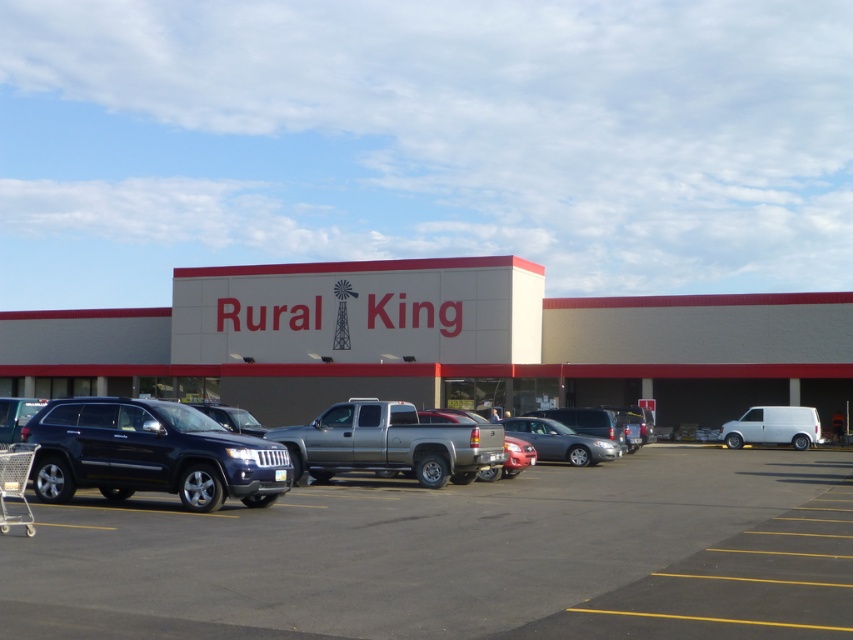
You are a customer who just arrived at the Rural King store. You see the dark gray asphalt at center and the satin silver suv at center. Which one is closer to you as you approach the store entrance?

The dark gray asphalt at center is closer to you because it is in front of the satin silver suv at center, meaning the suv is behind the asphalt area.

From the picture: You are standing in a field 50 meters away from the beige concrete building at center. Can you safely walk towards the building without crossing any obstacles?

The beige concrete building at center is 47.77 meters away from the viewer, so yes, you can safely walk towards the building without crossing any obstacles since you are only 50 meters away and the distance is sufficient.

You are standing at the entrance of the store and see the point marked at coordinates (387, 444). What object is located at that point?

The point at coordinates (387, 444) corresponds to the matte black suv at center.